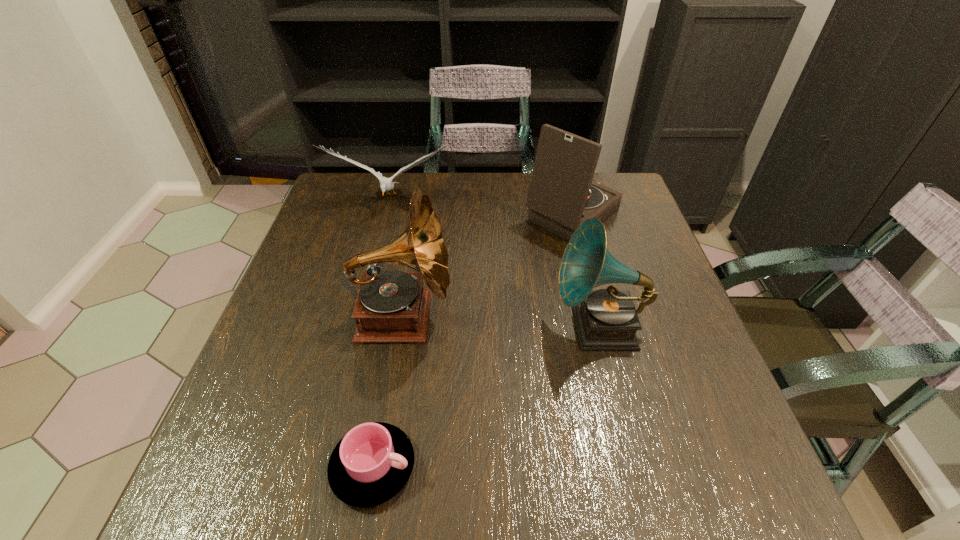
Find the location of a particular element. The height and width of the screenshot is (540, 960). gull at the far edge is located at coordinates (386, 184).

Identify the location of object located in the near edge section of the desktop. The height and width of the screenshot is (540, 960). (371, 464).

Where is `object positioned at the left edge`? object positioned at the left edge is located at coordinates (386, 184).

You are a GUI agent. You are given a task and a screenshot of the screen. Output one action in this format:
    pyautogui.click(x=<x>, y=<y>)
    Task: Click on the object present at the far left corner
    This screenshot has width=960, height=540.
    Given the screenshot: What is the action you would take?
    pyautogui.click(x=386, y=184)

Locate an element on the screen. object located in the far right corner section of the desktop is located at coordinates (562, 195).

Locate an element on the screen. vacant area at the far edge of the desktop is located at coordinates (411, 181).

In the image, there is a desktop. Identify the location of vacant space at the near edge. The width and height of the screenshot is (960, 540). (425, 510).

The width and height of the screenshot is (960, 540). In order to click on vacant space at the left edge of the desktop in this screenshot , I will do `click(291, 293)`.

The image size is (960, 540). Find the location of `free space at the right edge of the desktop`. free space at the right edge of the desktop is located at coordinates (685, 321).

Identify the location of vacant space at the far left corner. (351, 212).